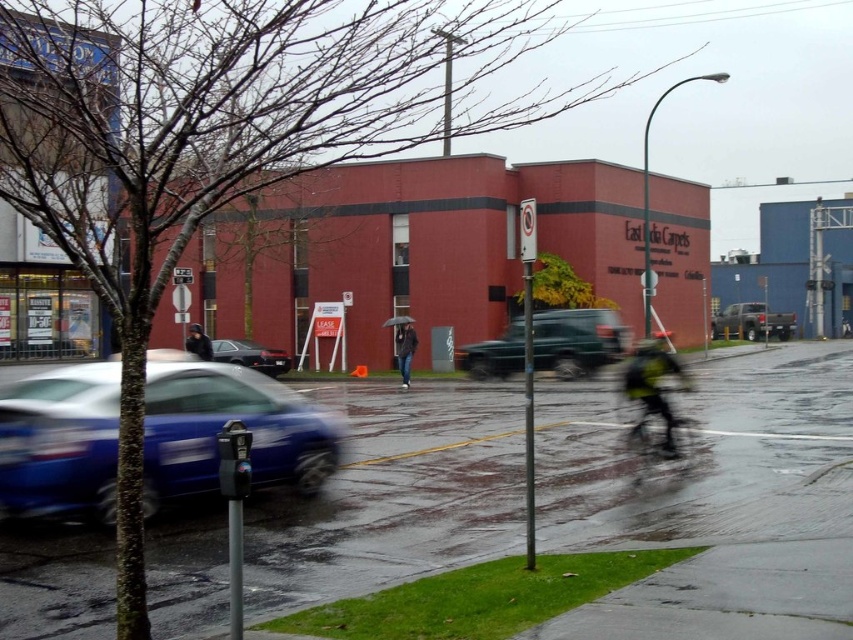
Which is in front, point (410, 352) or point (189, 328)?

Point (410, 352) is more forward.

Is dark blue jeans at center positioned at the back of dark gray jacket at center?

Yes, dark blue jeans at center is behind dark gray jacket at center.

Is point (408, 387) farther from viewer compared to point (196, 330)?

Yes, it is.

Find the location of a particular element. The image size is (853, 640). dark blue jeans at center is located at coordinates (405, 349).

Is metallic blue sedan at lower left to the left of shiny black sedan at center from the viewer's perspective?

Incorrect, metallic blue sedan at lower left is not on the left side of shiny black sedan at center.

Based on the photo, between metallic blue sedan at lower left and shiny black sedan at center, which one is positioned lower?

Positioned lower is metallic blue sedan at lower left.

Is point (97, 515) farther from camera compared to point (271, 364)?

No.

I want to click on metallic blue sedan at lower left, so click(221, 426).

Is metallic blue sedan at lower left positioned at the back of yellow-green reflective jacket at center-right?

No.

Find the location of a particular element. Image resolution: width=853 pixels, height=640 pixels. metallic blue sedan at lower left is located at coordinates (221, 426).

The height and width of the screenshot is (640, 853). I want to click on metallic blue sedan at lower left, so click(x=221, y=426).